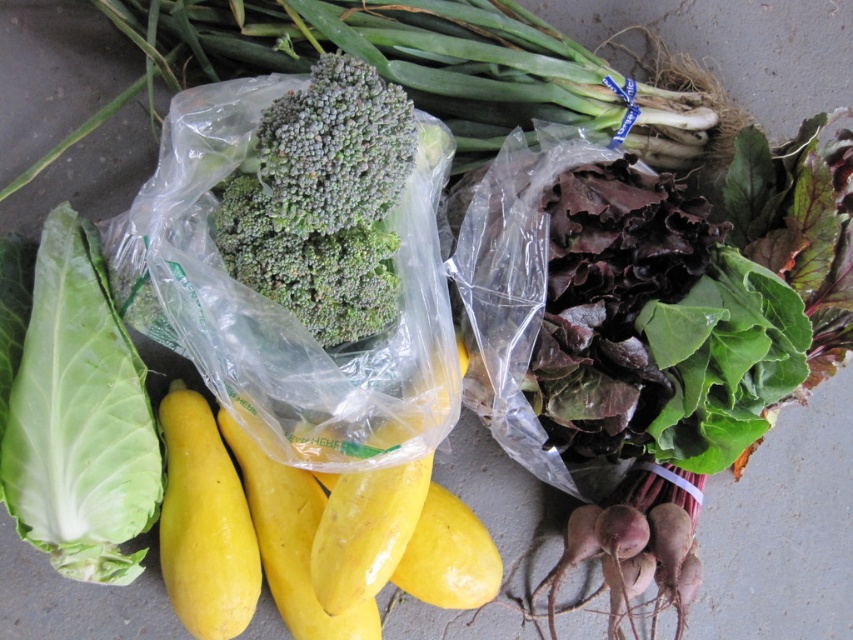
Consider the image. Measure the distance from green leafy at left to green matte broccoli at center.

A distance of 32.36 centimeters exists between green leafy at left and green matte broccoli at center.

Which of these two, green leafy at left or green matte broccoli at center, stands shorter?

green matte broccoli at center

Find the location of a particular element. Image resolution: width=853 pixels, height=640 pixels. green leafy at left is located at coordinates (74, 412).

Which is above, green matte broccoli at center or yellow matte squash at center?

Positioned higher is green matte broccoli at center.

Find the location of `green matte broccoli at center`. green matte broccoli at center is located at coordinates (323, 202).

Between yellow smooth squash at lower left and yellow matte squash at center, which one has more height?

yellow smooth squash at lower left is taller.

Who is more distant from viewer, (213, 493) or (334, 637)?

Positioned behind is point (213, 493).

Locate an element on the screen. Image resolution: width=853 pixels, height=640 pixels. yellow smooth squash at lower left is located at coordinates 204,524.